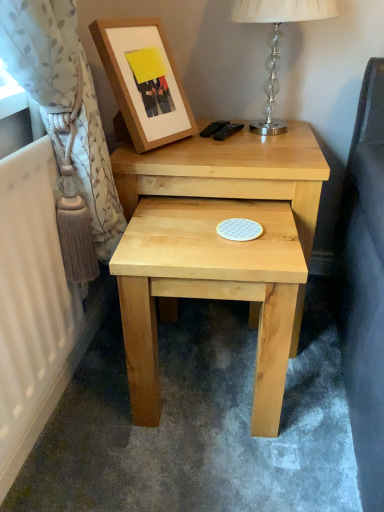
From the picture: Measure the distance between wooden picture frame at upper left and camera.

1.04 meters.

Measure the distance between natural wood stool at center and camera.

A distance of 32.48 inches exists between natural wood stool at center and camera.

What is the approximate height of light beige floral fabric curtain at left?

22.93 inches.

Where is `natural wood nightstand at center`? Image resolution: width=384 pixels, height=512 pixels. natural wood nightstand at center is located at coordinates (231, 173).

Describe the element at coordinates (231, 173) in the screenshot. I see `natural wood nightstand at center` at that location.

Where is `wooden picture frame at upper left`? wooden picture frame at upper left is located at coordinates (144, 81).

Does natural wood stool at center appear on the right side of clear glass lamp at upper right?

No, natural wood stool at center is not to the right of clear glass lamp at upper right.

Which is behind, natural wood stool at center or clear glass lamp at upper right?

Positioned behind is clear glass lamp at upper right.

Is point (204, 240) farther from viewer compared to point (283, 4)?

No, it is in front of (283, 4).

Considering the relative sizes of natural wood stool at center and clear glass lamp at upper right in the image provided, is natural wood stool at center wider than clear glass lamp at upper right?

Yes, natural wood stool at center is wider than clear glass lamp at upper right.

Can you confirm if clear glass lamp at upper right is positioned to the left of light beige floral fabric curtain at left?

No.

Is clear glass lamp at upper right not within light beige floral fabric curtain at left?

clear glass lamp at upper right lies outside light beige floral fabric curtain at left's area.

Looking at the image, does clear glass lamp at upper right seem bigger or smaller compared to light beige floral fabric curtain at left?

Clearly, clear glass lamp at upper right is smaller in size than light beige floral fabric curtain at left.

Which of these two, clear glass lamp at upper right or light beige floral fabric curtain at left, is wider?

clear glass lamp at upper right.

Is wooden picture frame at upper left oriented away from light beige floral fabric curtain at left?

No.

Based on their sizes in the image, would you say wooden picture frame at upper left is bigger or smaller than light beige floral fabric curtain at left?

Considering their sizes, wooden picture frame at upper left takes up less space than light beige floral fabric curtain at left.

Considering the sizes of objects wooden picture frame at upper left and light beige floral fabric curtain at left in the image provided, who is taller, wooden picture frame at upper left or light beige floral fabric curtain at left?

With more height is light beige floral fabric curtain at left.

How different are the orientations of wooden picture frame at upper left and light beige floral fabric curtain at left in degrees?

The angular difference between wooden picture frame at upper left and light beige floral fabric curtain at left is 27.7 degrees.

Considering the sizes of wooden picture frame at upper left and natural wood stool at center in the image, is wooden picture frame at upper left wider or thinner than natural wood stool at center?

In the image, wooden picture frame at upper left appears to be more narrow than natural wood stool at center.

Can natural wood stool at center be found inside wooden picture frame at upper left?

No.

Between wooden picture frame at upper left and natural wood stool at center, which one has larger size?

natural wood stool at center is bigger.

Looking at this image, based on their sizes in the image, would you say clear glass lamp at upper right is bigger or smaller than natural wood stool at center?

Considering their sizes, clear glass lamp at upper right takes up less space than natural wood stool at center.

Does clear glass lamp at upper right have a greater width compared to natural wood stool at center?

No.

From the image's perspective, between clear glass lamp at upper right and natural wood stool at center, which one is located above?

clear glass lamp at upper right, from the image's perspective.

How different are the orientations of light beige floral fabric curtain at left and natural wood stool at center in degrees?

light beige floral fabric curtain at left and natural wood stool at center are facing 86.2 degrees away from each other.

Find the location of a particular element. This screenshot has width=384, height=512. stool behind the light beige floral fabric curtain at left is located at coordinates coord(208,289).

From the image's perspective, who appears lower, light beige floral fabric curtain at left or natural wood stool at center?

natural wood stool at center appears lower in the image.

Is light beige floral fabric curtain at left touching natural wood stool at center?

No, light beige floral fabric curtain at left is not touching natural wood stool at center.

From the picture: Is light beige floral fabric curtain at left shorter than natural wood nightstand at center?

Correct, light beige floral fabric curtain at left is not as tall as natural wood nightstand at center.

How different are the orientations of light beige floral fabric curtain at left and natural wood nightstand at center in degrees?

They differ by 87.9 degrees in their facing directions.

From a real-world perspective, which is physically above, light beige floral fabric curtain at left or natural wood nightstand at center?

light beige floral fabric curtain at left is physically above.

Could you tell me if light beige floral fabric curtain at left is facing natural wood nightstand at center?

No.

Find the location of a particular element. This screenshot has height=512, width=384. table lamp that is above the natural wood stool at center (from the image's perspective) is located at coordinates (277, 42).

Locate an element on the screen. curtain directly beneath the clear glass lamp at upper right (from a real-world perspective) is located at coordinates (64, 99).

Estimate the real-world distances between objects in this image. Which object is closer to wooden picture frame at upper left, natural wood nightstand at center or clear glass lamp at upper right?

Among the two, natural wood nightstand at center is located nearer to wooden picture frame at upper left.

Based on their spatial positions, is clear glass lamp at upper right or light beige floral fabric curtain at left further from natural wood stool at center?

Among the two, clear glass lamp at upper right is located further to natural wood stool at center.

Considering their positions, is natural wood nightstand at center positioned further to natural wood stool at center than clear glass lamp at upper right?

Based on the image, clear glass lamp at upper right appears to be further to natural wood stool at center.

From the image, which object appears to be nearer to wooden picture frame at upper left, natural wood stool at center or light beige floral fabric curtain at left?

light beige floral fabric curtain at left is closer to wooden picture frame at upper left.

Which object lies further to the anchor point light beige floral fabric curtain at left, clear glass lamp at upper right or wooden picture frame at upper left?

Among the two, clear glass lamp at upper right is located further to light beige floral fabric curtain at left.

Looking at the image, which one is located further to natural wood stool at center, wooden picture frame at upper left or natural wood nightstand at center?

Based on the image, wooden picture frame at upper left appears to be further to natural wood stool at center.

Considering their positions, is clear glass lamp at upper right positioned closer to wooden picture frame at upper left than natural wood stool at center?

Based on the image, clear glass lamp at upper right appears to be nearer to wooden picture frame at upper left.

Which object lies nearer to the anchor point light beige floral fabric curtain at left, natural wood stool at center or clear glass lamp at upper right?

Based on the image, natural wood stool at center appears to be nearer to light beige floral fabric curtain at left.

Find the location of a particular element. This screenshot has width=384, height=512. picture frame between light beige floral fabric curtain at left and natural wood nightstand at center from front to back is located at coordinates (144, 81).

You are a GUI agent. You are given a task and a screenshot of the screen. Output one action in this format:
    pyautogui.click(x=<x>, y=<y>)
    Task: Click on the stool between light beige floral fabric curtain at left and natural wood nightstand at center from front to back
    The width and height of the screenshot is (384, 512).
    Given the screenshot: What is the action you would take?
    pyautogui.click(x=208, y=289)

Image resolution: width=384 pixels, height=512 pixels. I want to click on picture frame between clear glass lamp at upper right and natural wood nightstand at center in the vertical direction, so (144, 81).

Identify the location of picture frame between clear glass lamp at upper right and natural wood stool at center in the up-down direction. (144, 81).